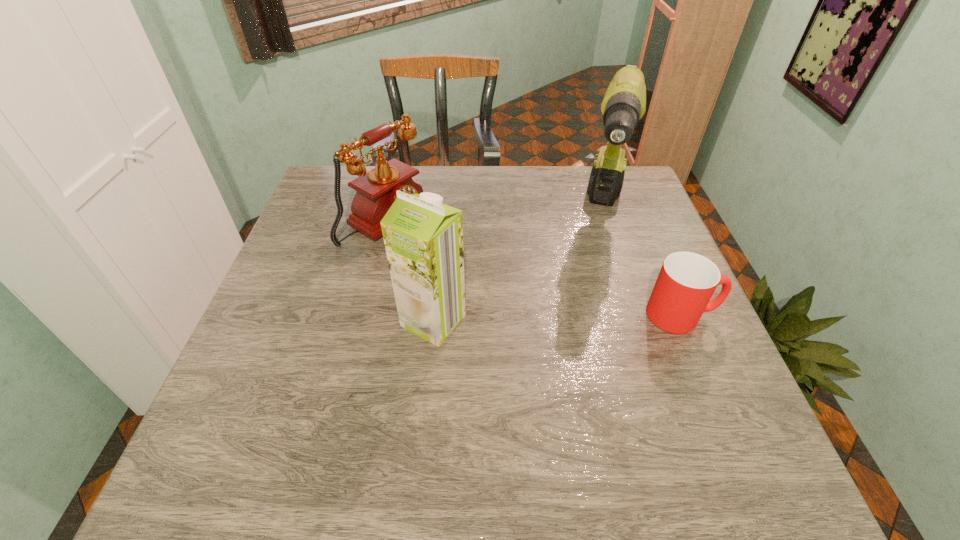
This screenshot has width=960, height=540. Find the location of `soya milk`. soya milk is located at coordinates (423, 238).

Locate an element on the screen. This screenshot has height=540, width=960. cup is located at coordinates (686, 282).

This screenshot has width=960, height=540. Find the location of `drill`. drill is located at coordinates (624, 104).

The height and width of the screenshot is (540, 960). In order to click on the second shortest object in this screenshot , I will do `click(376, 190)`.

Identify the location of vacant space situated on the front of the soya milk. The image size is (960, 540). (426, 390).

This screenshot has height=540, width=960. Find the location of `free spot located 0.350m on the handle side of the drill`. free spot located 0.350m on the handle side of the drill is located at coordinates (588, 362).

Image resolution: width=960 pixels, height=540 pixels. In order to click on vacant space located 0.060m on the handle side of the drill in this screenshot , I will do `click(604, 265)`.

I want to click on vacant space located 0.360m on the handle side of the drill, so pyautogui.click(x=587, y=366).

This screenshot has width=960, height=540. I want to click on vacant space located on the dial of the telephone, so click(x=537, y=306).

Locate an element on the screen. The height and width of the screenshot is (540, 960). free region located on the dial of the telephone is located at coordinates (470, 268).